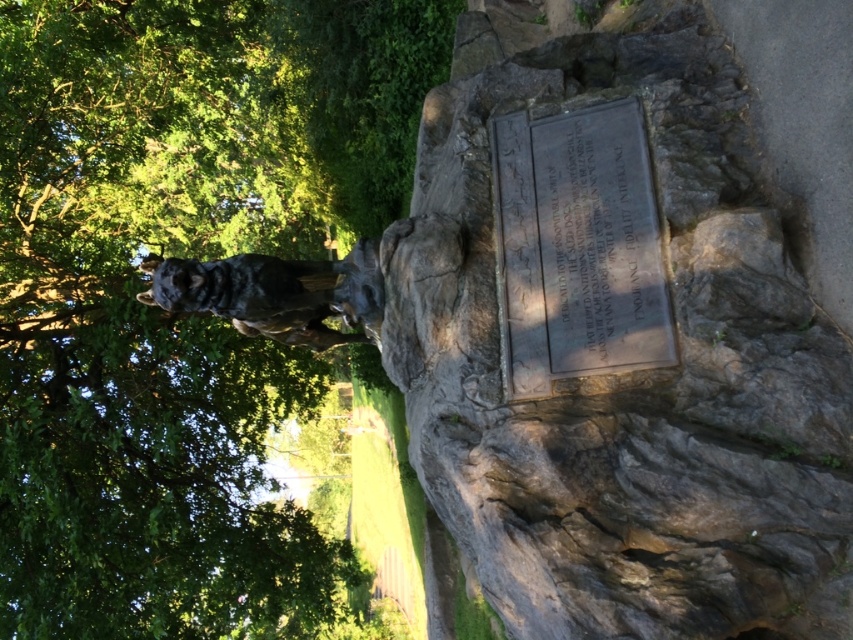
Question: Which of the following is the closest to the observer?

Choices:
 (A) (62, 333)
 (B) (550, 508)
 (C) (643, 257)

Answer: (B)

Question: Estimate the real-world distances between objects in this image. Which object is farther from the bronze plaque at upper center?

Choices:
 (A) shiny bronze wolf at center
 (B) gray rough stone at center

Answer: (A)

Question: Considering the relative positions of bronze plaque at upper center and shiny bronze wolf at center in the image provided, where is bronze plaque at upper center located with respect to shiny bronze wolf at center?

Choices:
 (A) below
 (B) above

Answer: (B)

Question: Which object is positioned closest to the shiny bronze wolf at center?

Choices:
 (A) gray rough stone at center
 (B) bronze plaque at upper center

Answer: (B)

Question: Does gray rough stone at center appear on the right side of green leafy tree at upper left?

Choices:
 (A) no
 (B) yes

Answer: (B)

Question: Is green leafy tree at upper left positioned behind bronze plaque at upper center?

Choices:
 (A) yes
 (B) no

Answer: (A)